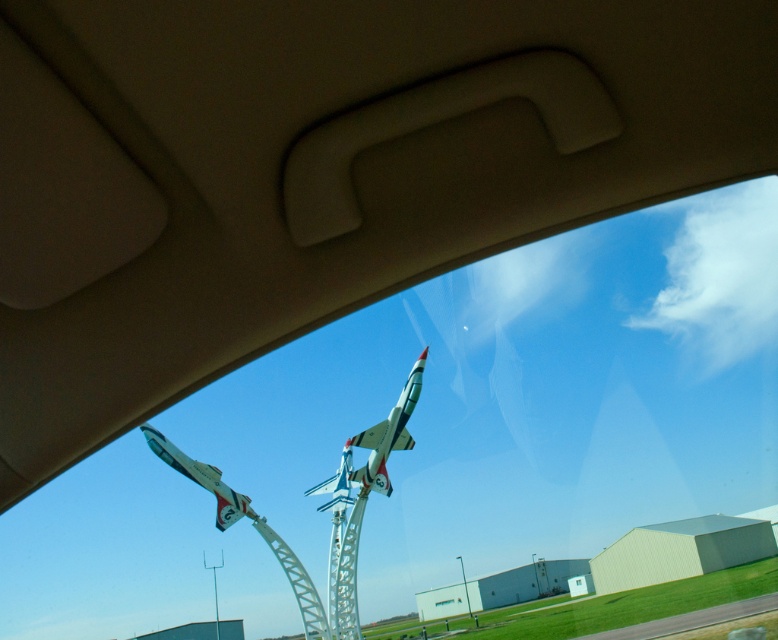
Question: Can you confirm if shiny metallic airplane at center is bigger than shiny metallic airplane at lower left?

Choices:
 (A) no
 (B) yes

Answer: (B)

Question: Which point is closer to the camera taking this photo?

Choices:
 (A) (349, 481)
 (B) (226, 490)

Answer: (B)

Question: Does shiny metallic airplane at center appear under shiny metallic airplane at lower left?

Choices:
 (A) yes
 (B) no

Answer: (B)

Question: Does shiny metallic airplane at center have a larger size compared to shiny metallic airplane at lower left?

Choices:
 (A) yes
 (B) no

Answer: (A)

Question: Which point appears farthest from the camera in this image?

Choices:
 (A) (219, 500)
 (B) (401, 413)

Answer: (B)